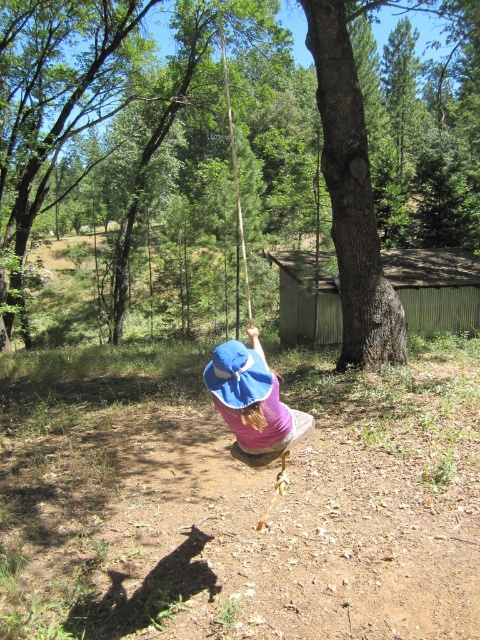
You are standing at the center of the forest and see the point marked at coordinates (359, 148). What object is located at that point?

The point at coordinates (359, 148) marks the location of the brown rough tree at center.